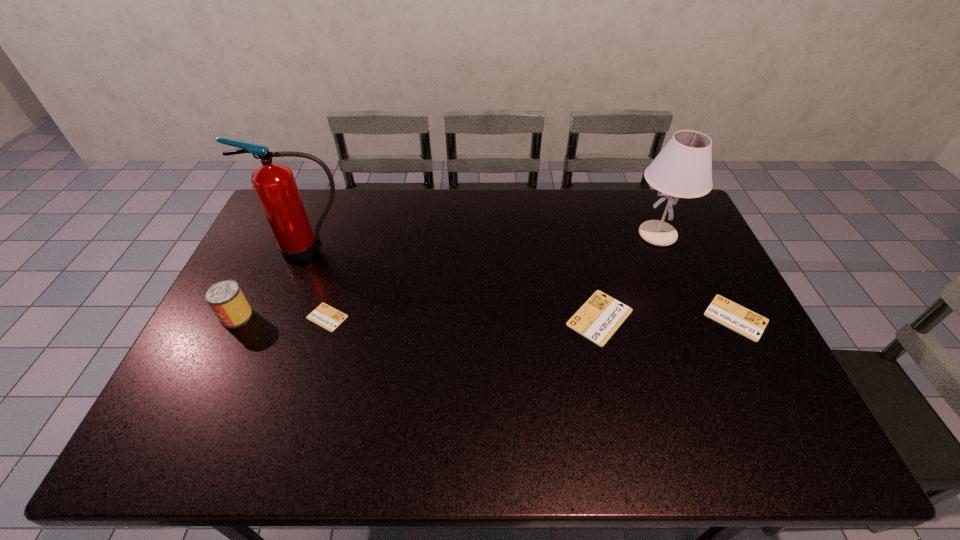
Find the location of `free point between the second tallest identity card and the leftmost identity card`. free point between the second tallest identity card and the leftmost identity card is located at coordinates (x=532, y=318).

This screenshot has width=960, height=540. Find the location of `unoccupied area between the fire extinguisher and the shortest object`. unoccupied area between the fire extinguisher and the shortest object is located at coordinates (319, 284).

Find the location of a particular element. This screenshot has height=540, width=960. free area in between the shortest identity card and the fourth object from left to right is located at coordinates (464, 318).

The width and height of the screenshot is (960, 540). What are the coordinates of `empty space between the lampshade and the third object from right to left` in the screenshot? It's located at (629, 276).

Locate which object is the fifth closest to the leftmost identity card. Please provide its 2D coordinates. Your answer should be formatted as a tuple, i.e. [(x, y)], where the tuple contains the x and y coordinates of a point satisfying the conditions above.

[(728, 313)]

Where is `object that is the fourth closest to the fire extinguisher`? object that is the fourth closest to the fire extinguisher is located at coordinates (683, 169).

At what (x,y) coordinates should I click in order to perform the action: click on identity card that is the closest to the lampshade. Please return your answer as a coordinate pair (x, y). Image resolution: width=960 pixels, height=540 pixels. Looking at the image, I should click on click(x=598, y=319).

Image resolution: width=960 pixels, height=540 pixels. What are the coordinates of `identity card that can be found as the second closest to the third object from right to left` in the screenshot? It's located at (324, 315).

Where is `free space that satisfies the following two spatial constraints: 1. on the front side of the fire extinguisher; 2. on the right side of the leftmost identity card`? The height and width of the screenshot is (540, 960). free space that satisfies the following two spatial constraints: 1. on the front side of the fire extinguisher; 2. on the right side of the leftmost identity card is located at coordinates (283, 317).